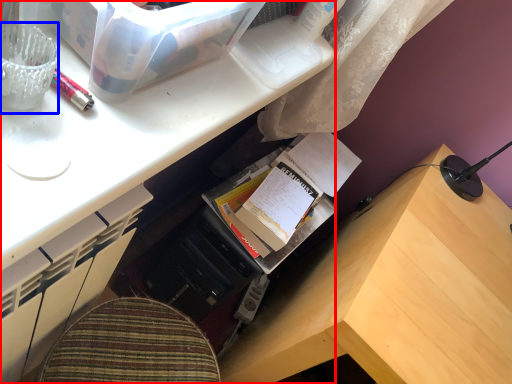
Question: Which object appears closest to the camera in this image, desk (highlighted by a red box) or stationery (highlighted by a blue box)?

Choices:
 (A) desk
 (B) stationery

Answer: (A)